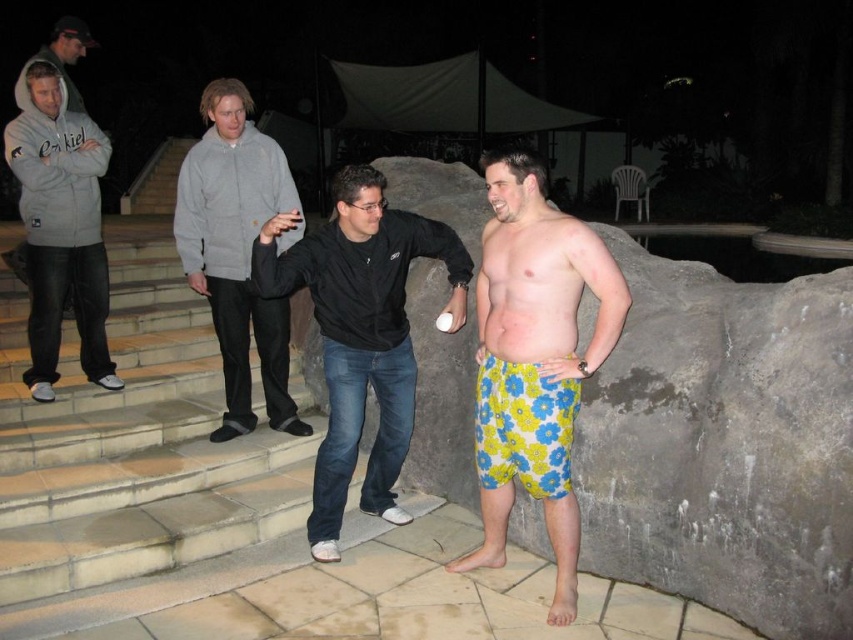
Question: Does black matte jacket at center have a larger size compared to matte gray hoodie at upper left?

Choices:
 (A) yes
 (B) no

Answer: (A)

Question: Which object is the closest to the gray fleece hoodie at left?

Choices:
 (A) floral-patterned shorts at center
 (B) matte gray hoodie at left

Answer: (B)

Question: Which of the following is the farthest from the observer?

Choices:
 (A) gray fleece hoodie at left
 (B) floral cotton shorts at center
 (C) black matte jacket at center
 (D) matte gray hoodie at left

Answer: (D)

Question: Which point is farther to the camera?

Choices:
 (A) matte gray hoodie at left
 (B) gray fleece hoodie at left
 (C) floral cotton shorts at center
 (D) floral-patterned shorts at center

Answer: (A)

Question: Does floral-patterned shorts at center have a smaller size compared to matte gray hoodie at left?

Choices:
 (A) no
 (B) yes

Answer: (B)

Question: Considering the relative positions of floral cotton shorts at center and matte gray hoodie at upper left in the image provided, where is floral cotton shorts at center located with respect to matte gray hoodie at upper left?

Choices:
 (A) left
 (B) right

Answer: (B)